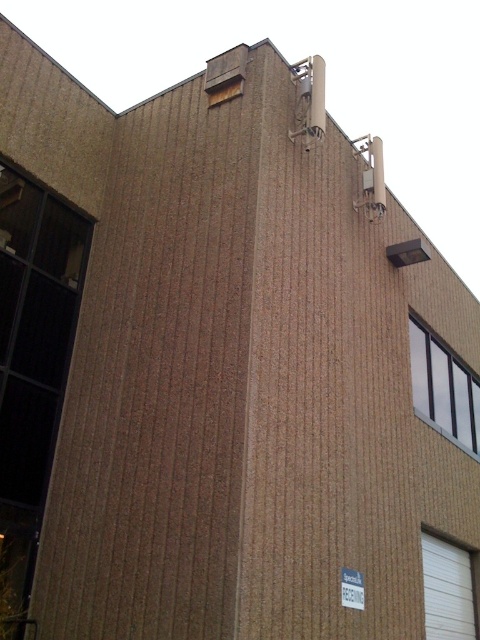
You are an architect assessing the building facade. You need to determine if the white glass window at upper center can accommodate a new decorative frame that requires a width of 1.2 meters. The white plastic sign at lower center currently has a width of 0.8 meters. Can the window potentially fit the frame based on their relative widths?

The white glass window at upper center might be wider than the white plastic sign at lower center, which is 0.8 meters. Since the window could be wider, it might potentially fit the 1.2 meter frame, but exact measurements are needed for confirmation.

You are standing in front of the building shown in the image. You see a point marked at coordinates (447, 589). What object is located at this point?

The point at coordinates (447, 589) marks the white textured door at lower right.